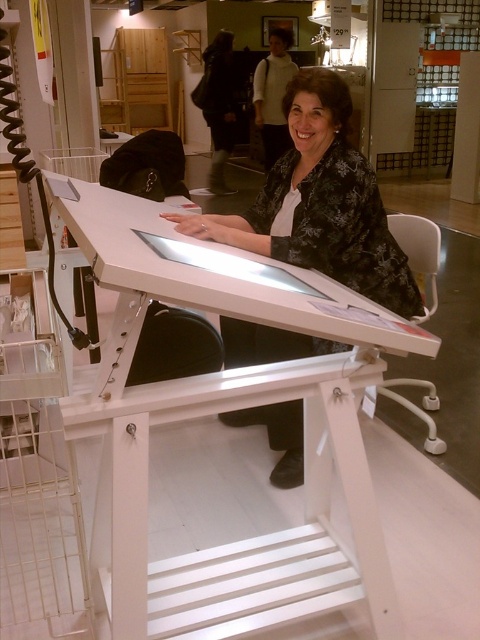
Question: Which point is farther to the camera?

Choices:
 (A) black floral blouse at center
 (B) white matte table at center

Answer: (A)

Question: Does white matte table at center appear on the left side of black floral blouse at center?

Choices:
 (A) yes
 (B) no

Answer: (A)

Question: Which point is closer to the camera?

Choices:
 (A) white matte table at center
 (B) black floral blouse at center

Answer: (A)

Question: Does white matte table at center appear under black floral blouse at center?

Choices:
 (A) yes
 (B) no

Answer: (A)

Question: Observing the image, what is the correct spatial positioning of white matte table at center in reference to black floral blouse at center?

Choices:
 (A) below
 (B) above

Answer: (A)